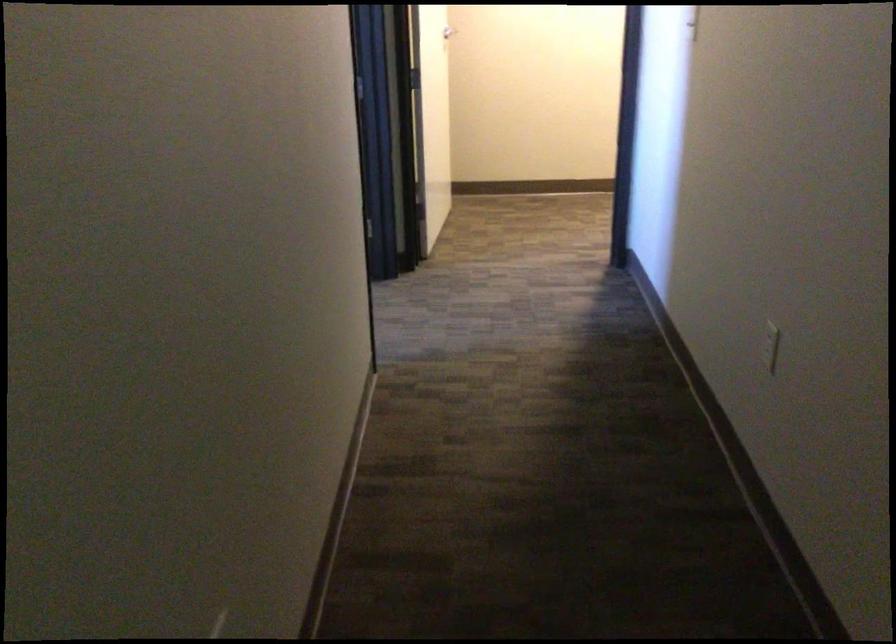
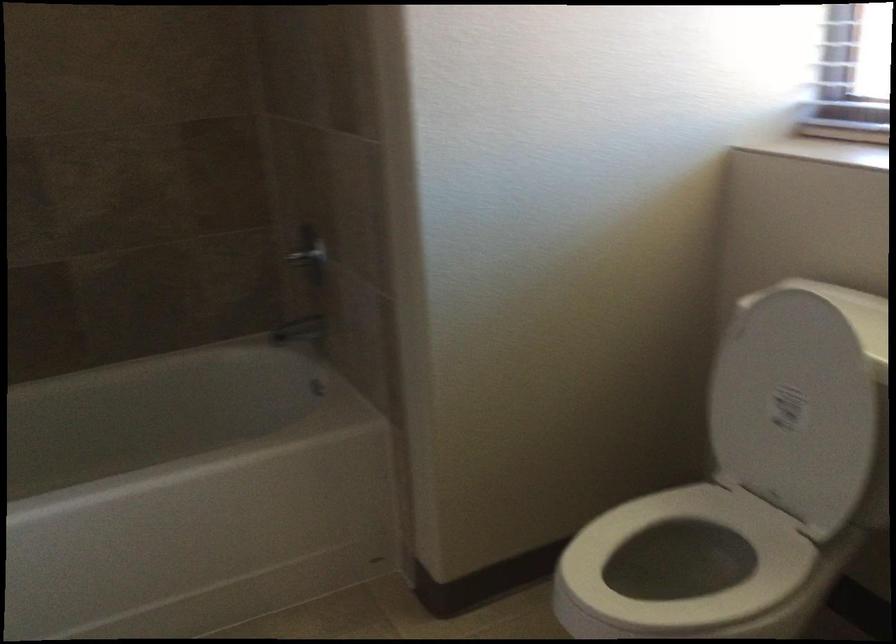
Question: Which direction would the cameraman need to move to produce the second image? Reply with the corresponding letter.

Choices:
 (A) Left
 (B) Right
 (C) Forward
 (D) Backward

Answer: (D)